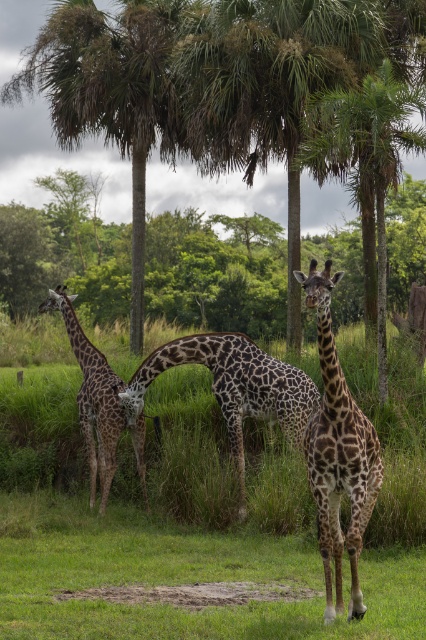
Question: Which point is closer to the camera?

Choices:
 (A) spotted brown giraffe at center
 (B) spotted fur giraffe at left
 (C) green leafy palm tree at center

Answer: (A)

Question: Does spotted brown giraffe at center lie behind spotted fur giraffe at left?

Choices:
 (A) yes
 (B) no

Answer: (B)

Question: Which object is farther from the camera taking this photo?

Choices:
 (A) green leafy palm tree at upper center
 (B) spotted brown giraffe at center
 (C) spotted fur giraffe at left
 (D) green leafy tree at center

Answer: (D)

Question: Can you confirm if spotted fur giraffe at center is thinner than spotted fur giraffe at left?

Choices:
 (A) no
 (B) yes

Answer: (A)

Question: Which of these objects is positioned closest to the spotted fur giraffe at center?

Choices:
 (A) spotted brown giraffe at center
 (B) spotted fur giraffe at left

Answer: (A)

Question: Does green leafy tree at center appear over spotted fur giraffe at left?

Choices:
 (A) no
 (B) yes

Answer: (B)